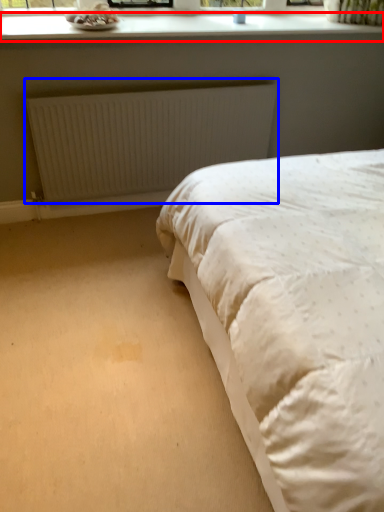
Question: Which point is closer to the camera, window sill (highlighted by a red box) or radiator (highlighted by a blue box)?

Choices:
 (A) window sill
 (B) radiator

Answer: (A)